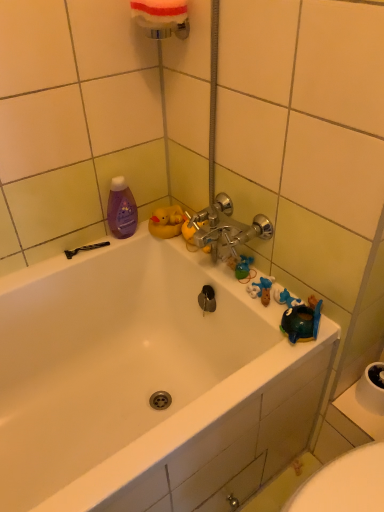
Describe the element at coordinates (146, 382) in the screenshot. The image size is (384, 512). I see `white glossy bathtub at upper center` at that location.

In order to face black plastic razor at lower left, should I rotate leftwards or rightwards?

You should rotate left by 13.995 degrees.

The width and height of the screenshot is (384, 512). Identify the location of white foam sponge at upper center. (162, 17).

Is white foam sponge at upper center next to white glossy bathtub at upper center?

No, white foam sponge at upper center is not next to white glossy bathtub at upper center.

Would you say white foam sponge at upper center contains white glossy bathtub at upper center?

Actually, white glossy bathtub at upper center is outside white foam sponge at upper center.

Can you confirm if white foam sponge at upper center is taller than white glossy bathtub at upper center?

No.

Is white foam sponge at upper center turned away from white glossy bathtub at upper center?

No, white foam sponge at upper center is not facing away from white glossy bathtub at upper center.

How distant is black plastic razor at lower left from white foam sponge at upper center?

The distance of black plastic razor at lower left from white foam sponge at upper center is 25.33 inches.

Is the surface of black plastic razor at lower left in direct contact with white foam sponge at upper center?

There is a gap between black plastic razor at lower left and white foam sponge at upper center.

Does black plastic razor at lower left have a lesser height compared to white foam sponge at upper center?

Yes, black plastic razor at lower left is shorter than white foam sponge at upper center.

From the image's perspective, which one is positioned higher, black plastic razor at lower left or white foam sponge at upper center?

From the image's view, white foam sponge at upper center is above.

From their relative heights in the image, would you say purple glossy bottle at upper left is taller or shorter than white foam sponge at upper center?

Considering their sizes, purple glossy bottle at upper left has more height than white foam sponge at upper center.

This screenshot has width=384, height=512. Find the location of `towel bar that is on the right side of purple glossy bottle at upper left`. towel bar that is on the right side of purple glossy bottle at upper left is located at coordinates click(x=162, y=17).

Is point (132, 227) farther from camera compared to point (134, 17)?

Yes, point (132, 227) is farther from viewer.

Does black plastic razor at lower left have a smaller size compared to white glossy bathtub at upper center?

Yes, black plastic razor at lower left is smaller than white glossy bathtub at upper center.

From the picture: From a real-world perspective, which is physically below, black plastic razor at lower left or white glossy bathtub at upper center?

white glossy bathtub at upper center.

Is black plastic razor at lower left facing towards white glossy bathtub at upper center?

Yes, black plastic razor at lower left is facing white glossy bathtub at upper center.

Considering the relative positions of black plastic razor at lower left and white glossy bathtub at upper center in the image provided, is black plastic razor at lower left to the left of white glossy bathtub at upper center from the viewer's perspective?

Yes, black plastic razor at lower left is to the left of white glossy bathtub at upper center.

From the image's perspective, which is above, white glossy bathtub at upper center or purple glossy bottle at upper left?

purple glossy bottle at upper left, from the image's perspective.

In terms of height, does white glossy bathtub at upper center look taller or shorter compared to purple glossy bottle at upper left?

Considering their sizes, white glossy bathtub at upper center has more height than purple glossy bottle at upper left.

From a real-world perspective, is white glossy bathtub at upper center below purple glossy bottle at upper left?

Yes.

At what (x,y) coordinates should I click in order to perform the action: click on mouthwash that is behind the white glossy bathtub at upper center. Please return your answer as a coordinate pair (x, y). Looking at the image, I should click on pyautogui.click(x=121, y=209).

Which is closer, (172, 29) or (129, 215)?

Point (172, 29) appears to be closer to the viewer than point (129, 215).

How different are the orientations of white foam sponge at upper center and purple glossy bottle at upper left in degrees?

The angle between the facing direction of white foam sponge at upper center and the facing direction of purple glossy bottle at upper left is 89.6 degrees.

This screenshot has height=512, width=384. What are the coordinates of `mouthwash below the white foam sponge at upper center (from a real-world perspective)` in the screenshot? It's located at (121, 209).

Would you say purple glossy bottle at upper left is to the left or to the right of white glossy bathtub at upper center in the picture?

From the image, it's evident that purple glossy bottle at upper left is to the left of white glossy bathtub at upper center.

From the picture: Which is in front, purple glossy bottle at upper left or white glossy bathtub at upper center?

white glossy bathtub at upper center is closer to the camera.

Are purple glossy bottle at upper left and white glossy bathtub at upper center beside each other?

No, purple glossy bottle at upper left is not next to white glossy bathtub at upper center.

This screenshot has height=512, width=384. Identify the location of towel bar lying on the right of white glossy bathtub at upper center. (162, 17).

Find the location of a particular element. Image resolution: width=384 pixels, height=512 pixels. shower that appears below the white foam sponge at upper center (from the image's perspective) is located at coordinates (85, 249).

Based on their spatial positions, is white foam sponge at upper center or purple glossy bottle at upper left closer to white glossy bathtub at upper center?

The object closer to white glossy bathtub at upper center is purple glossy bottle at upper left.

Based on their spatial positions, is white foam sponge at upper center or purple glossy bottle at upper left closer to black plastic razor at lower left?

Based on the image, purple glossy bottle at upper left appears to be nearer to black plastic razor at lower left.

Which object lies further to the anchor point purple glossy bottle at upper left, white glossy bathtub at upper center or black plastic razor at lower left?

white glossy bathtub at upper center is positioned further to the anchor purple glossy bottle at upper left.

Which object lies nearer to the anchor point white foam sponge at upper center, white glossy bathtub at upper center or purple glossy bottle at upper left?

purple glossy bottle at upper left.

Consider the image. Estimate the real-world distances between objects in this image. Which object is further from purple glossy bottle at upper left, white foam sponge at upper center or black plastic razor at lower left?

white foam sponge at upper center lies further to purple glossy bottle at upper left than the other object.

Looking at the image, which one is located closer to white glossy bathtub at upper center, purple glossy bottle at upper left or white foam sponge at upper center?

purple glossy bottle at upper left is positioned closer to the anchor white glossy bathtub at upper center.

Estimate the real-world distances between objects in this image. Which object is further from black plastic razor at lower left, purple glossy bottle at upper left or white glossy bathtub at upper center?

The object further to black plastic razor at lower left is white glossy bathtub at upper center.

When comparing their distances from purple glossy bottle at upper left, does black plastic razor at lower left or white glossy bathtub at upper center seem closer?

black plastic razor at lower left lies closer to purple glossy bottle at upper left than the other object.

In order to click on mouthwash positioned between white glossy bathtub at upper center and black plastic razor at lower left from near to far in this screenshot , I will do `click(121, 209)`.

Find the location of a particular element. The width and height of the screenshot is (384, 512). mouthwash between white foam sponge at upper center and black plastic razor at lower left in the up-down direction is located at coordinates (121, 209).

Locate an element on the screen. Image resolution: width=384 pixels, height=512 pixels. mouthwash between white foam sponge at upper center and white glossy bathtub at upper center vertically is located at coordinates (121, 209).

Identify the location of shower between white foam sponge at upper center and white glossy bathtub at upper center from top to bottom. Image resolution: width=384 pixels, height=512 pixels. (85, 249).